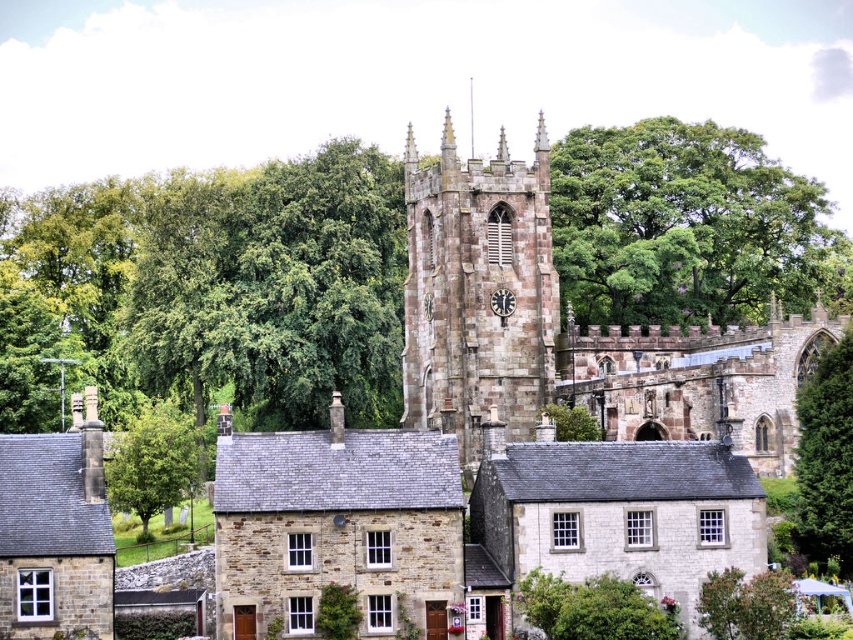
Is rustic stone church at center shorter than metallic clock at center?

No.

This screenshot has height=640, width=853. What are the coordinates of `rustic stone church at center` in the screenshot? It's located at (567, 330).

I want to click on rustic stone church at center, so click(567, 330).

Which is behind, point (843, 378) or point (492, 296)?

The point (492, 296) is more distant.

Is point (827, 484) farther from viewer compared to point (506, 298)?

No, it is in front of (506, 298).

Identify the location of green leafy tree at center. (827, 458).

Can you confirm if rustic stone church at center is positioned to the left of stone clock tower at center?

No, rustic stone church at center is not to the left of stone clock tower at center.

Between rustic stone church at center and stone clock tower at center, which one is positioned higher?

Positioned higher is stone clock tower at center.

Where is `rustic stone church at center`? The width and height of the screenshot is (853, 640). rustic stone church at center is located at coordinates (567, 330).